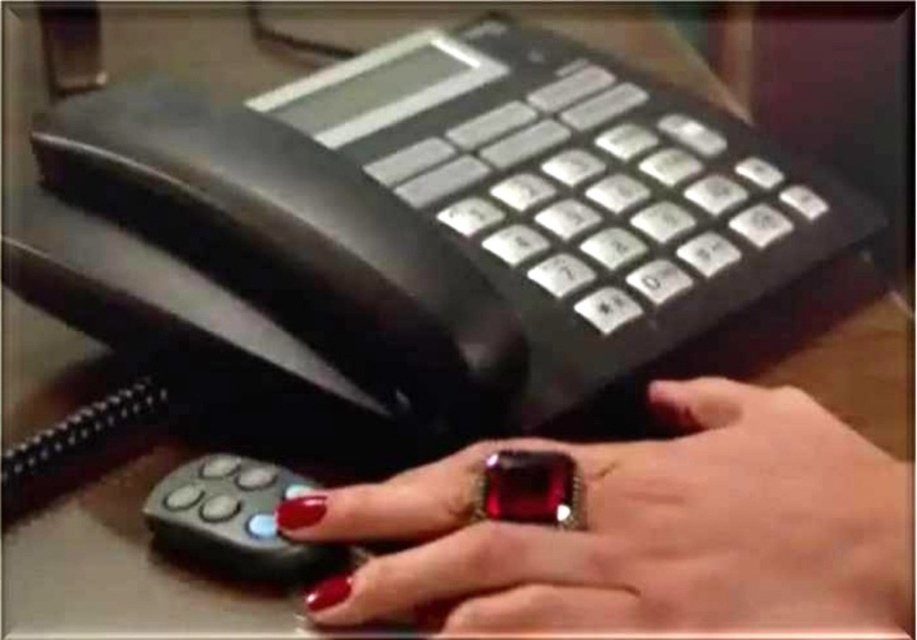
Question: Among these points, which one is farthest from the camera?

Choices:
 (A) (207, 515)
 (B) (522, 595)

Answer: (A)

Question: Which point is closer to the camera?

Choices:
 (A) black rubber remote at lower left
 (B) shiny red nail polish at center

Answer: (B)

Question: Is shiny red nail polish at center above black rubber remote at lower left?

Choices:
 (A) yes
 (B) no

Answer: (A)

Question: Which object appears farthest from the camera in this image?

Choices:
 (A) black rubber remote at lower left
 (B) shiny red nail polish at center

Answer: (A)

Question: Does shiny red nail polish at center have a larger size compared to black rubber remote at lower left?

Choices:
 (A) no
 (B) yes

Answer: (B)

Question: Is shiny red nail polish at center to the right of black rubber remote at lower left from the viewer's perspective?

Choices:
 (A) yes
 (B) no

Answer: (A)